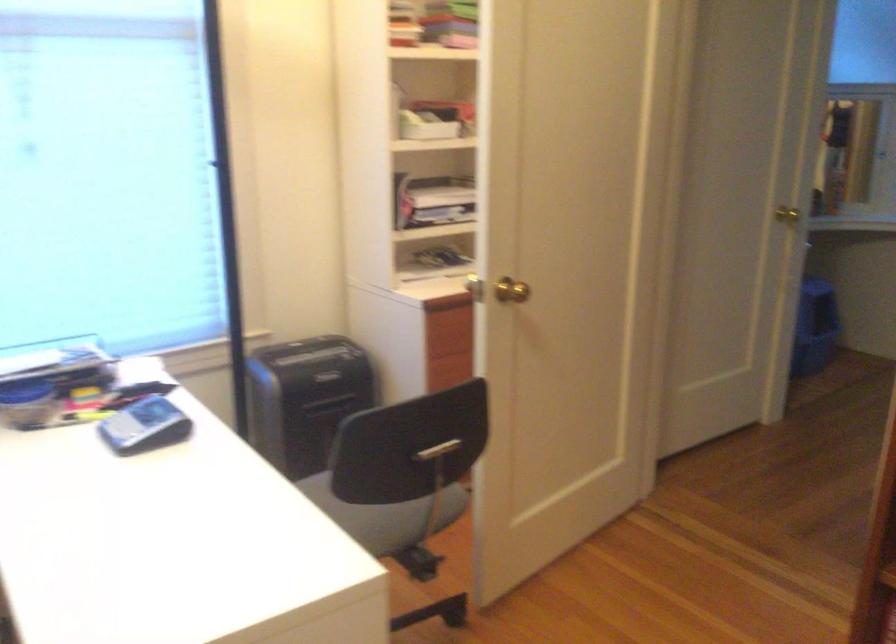
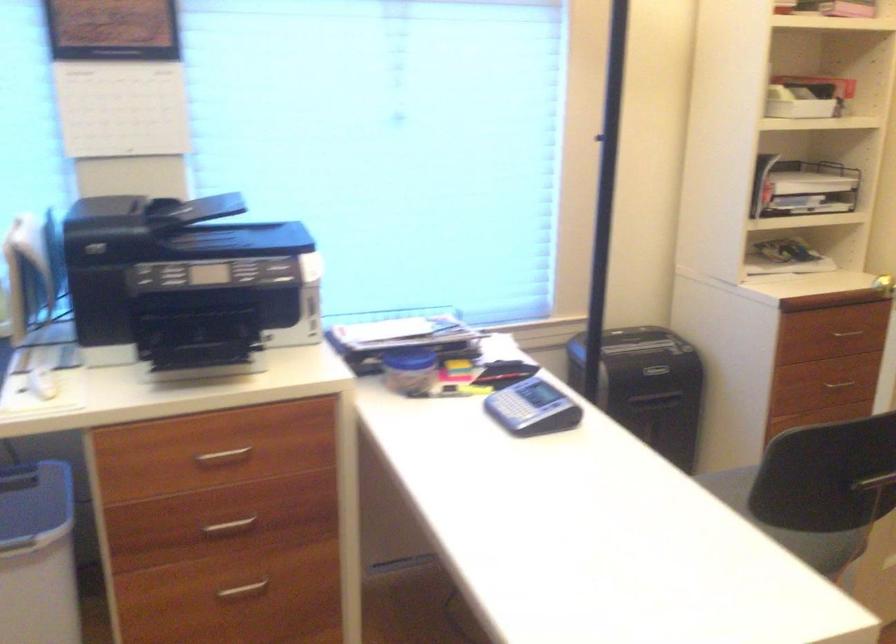
Find the pixel in the second image that matches (x=319, y=393) in the first image.

(647, 386)